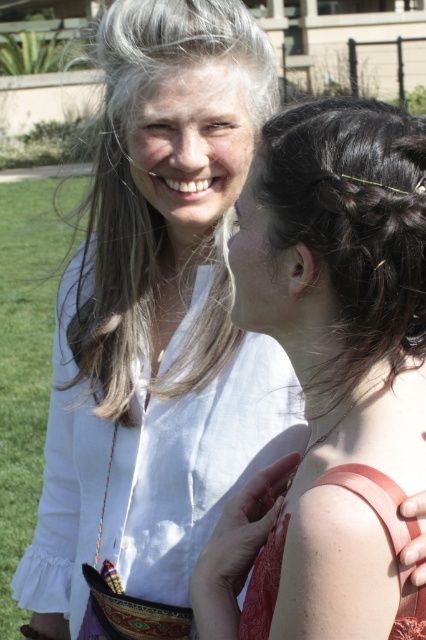
You are a fashion designer observing the two outfits in the image. The white cotton shirt at upper center and the matte coral fabric dress at lower right are both part of a new collection. If you need to create a display mannequin that can fit either outfit, what should the minimum width of the mannequin be based on the wider of the two outfits?

The white cotton shirt at upper center might be wider than matte coral fabric dress at lower right, so the minimum width of the mannequin should be based on the white cotton shirt at upper center to ensure it can accommodate both outfits.

You are standing at the point with coordinates point [134,531] and want to walk to the point with coordinates point [241,609]. Which direction should you move to get closer to your destination?

To move from point [134,531] to point [241,609], you should move forward since point [134,531] is behind point [241,609].

You are a photographer trying to capture a group photo of the grayhair at upper center and the matte coral fabric dress at lower right. If you want to ensure both subjects are fully visible in the frame, which subject should you position closer to the camera to avoid cropping?

The grayhair at upper center has a larger width than the matte coral fabric dress at lower right. To ensure both are fully visible, position the grayhair at upper center closer to the camera so that its larger size can fit within the frame without being cropped.